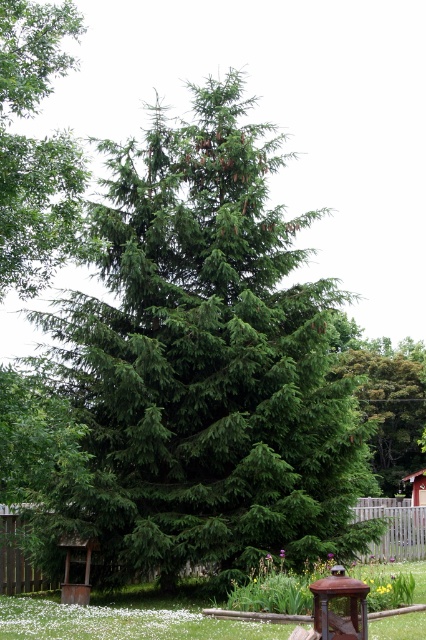
Who is positioned more to the right, green matte tree at upper left or green matte tree at center?

From the viewer's perspective, green matte tree at center appears more on the right side.

This screenshot has height=640, width=426. In order to click on green matte tree at upper left in this screenshot , I will do `click(34, 147)`.

What do you see at coordinates (34, 147) in the screenshot? I see `green matte tree at upper left` at bounding box center [34, 147].

This screenshot has width=426, height=640. In order to click on green matte tree at upper left in this screenshot , I will do `click(34, 147)`.